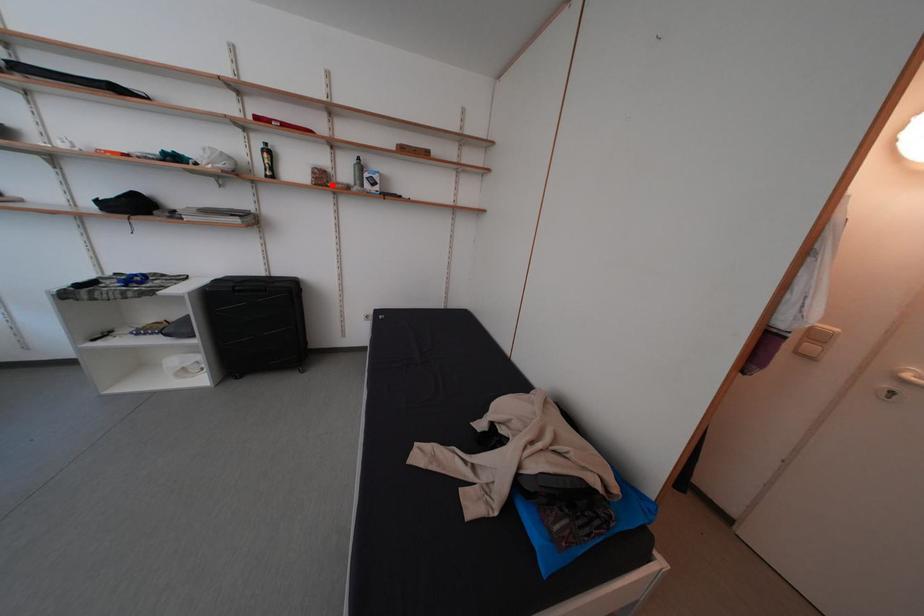
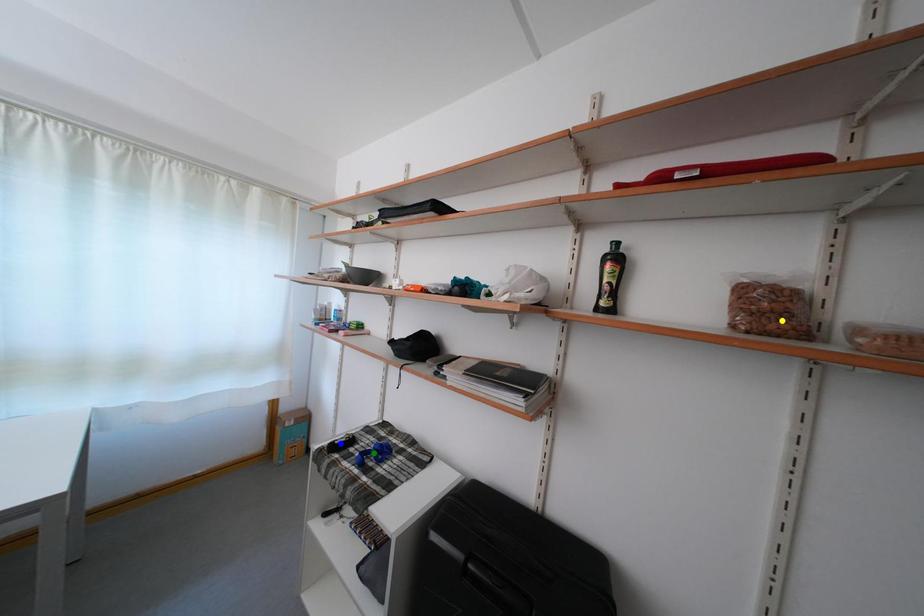
Question: I am providing you with two images of the same scene from different viewpoints. A red point is marked on the first image. You are given multiple points on the second image. Which point in image 2 represents the same 3d spot as the red point in image 1?

Choices:
 (A) green point
 (B) yellow point
 (C) blue point

Answer: (B)